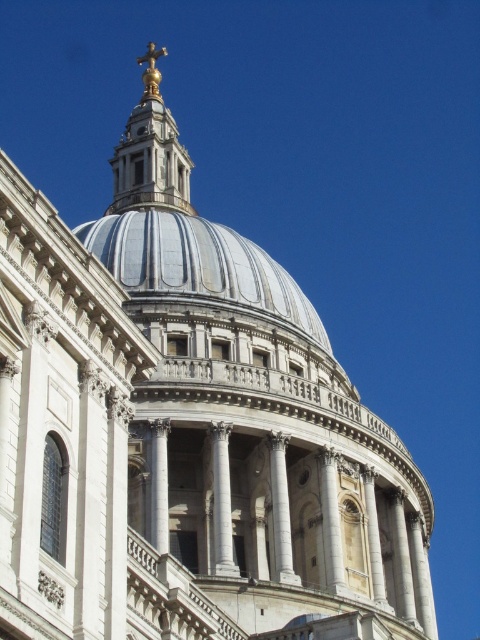
Question: Which point is farther from the camera taking this photo?

Choices:
 (A) (155, 131)
 (B) (168, 289)

Answer: (A)

Question: Does white marble dome at center appear on the right side of gold metallic cross at top?

Choices:
 (A) yes
 (B) no

Answer: (A)

Question: Which point appears closest to the camera in this image?

Choices:
 (A) (210, 298)
 (B) (153, 132)

Answer: (A)

Question: In this image, where is white marble dome at center located relative to gold metallic cross at top?

Choices:
 (A) below
 (B) above

Answer: (A)

Question: Does white marble dome at center lie in front of gold metallic cross at top?

Choices:
 (A) no
 (B) yes

Answer: (B)